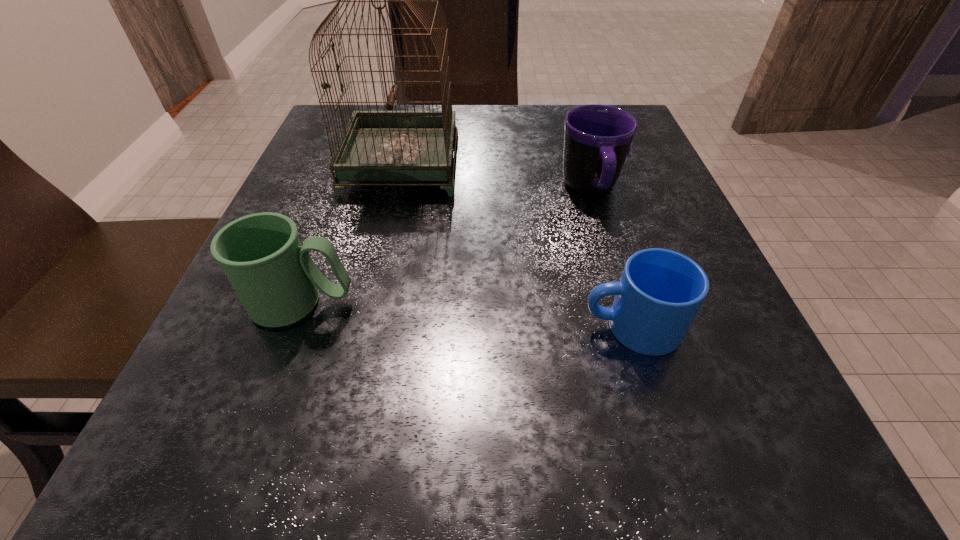
This screenshot has width=960, height=540. I want to click on birdcage, so click(376, 146).

The image size is (960, 540). I want to click on the farthest mug, so click(597, 138).

This screenshot has width=960, height=540. Identify the location of the leftmost mug. (275, 278).

The width and height of the screenshot is (960, 540). In order to click on the shortest mug in this screenshot , I will do `click(660, 291)`.

Where is `free region located at the door of the tallest object`? free region located at the door of the tallest object is located at coordinates (567, 165).

In order to click on free space located with the handle on the side of the farthest mug in this screenshot , I will do `click(662, 432)`.

The image size is (960, 540). Find the location of `blank area located on the side of the leftmost mug with the handle`. blank area located on the side of the leftmost mug with the handle is located at coordinates (602, 303).

This screenshot has height=540, width=960. In order to click on free space located on the side of the shortest mug with the handle in this screenshot , I will do `click(463, 327)`.

Locate an element on the screen. The width and height of the screenshot is (960, 540). free space located on the side of the shortest mug with the handle is located at coordinates (486, 327).

Image resolution: width=960 pixels, height=540 pixels. In order to click on vacant space located 0.180m on the side of the shortest mug with the handle in this screenshot , I will do `click(448, 327)`.